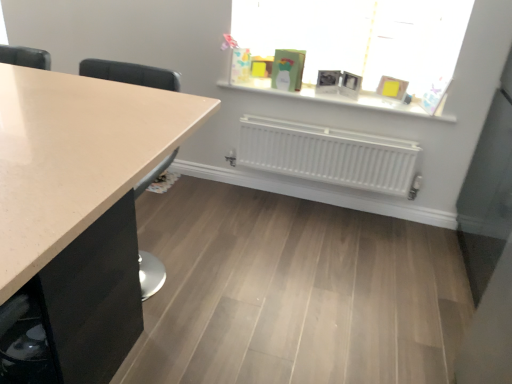
The width and height of the screenshot is (512, 384). I want to click on free space to the back side of matte beige countertop at left, so click(172, 222).